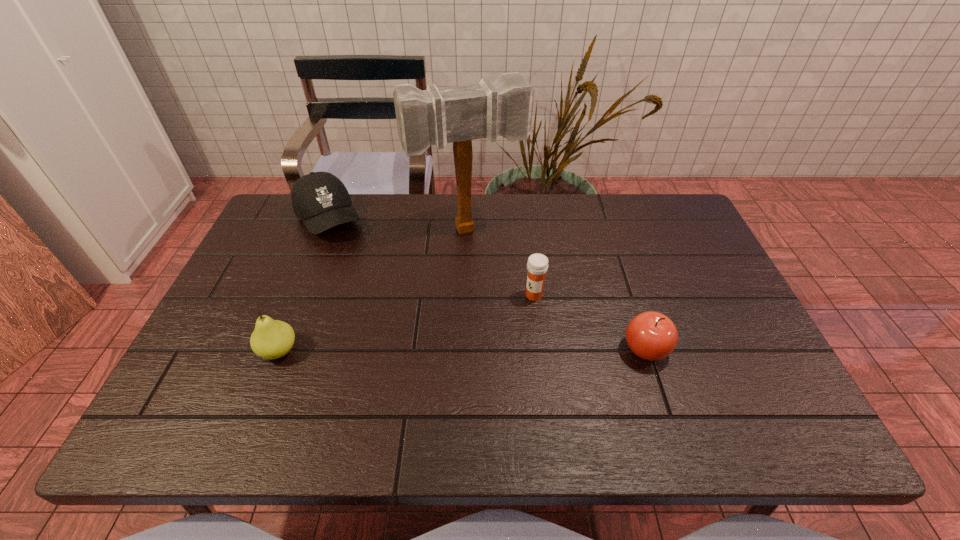
At what (x,y) coordinates should I click in order to perform the action: click on pear. Please return your answer as a coordinate pair (x, y). The image size is (960, 540). Looking at the image, I should click on (271, 339).

In order to click on apple in this screenshot , I will do `click(652, 336)`.

At what (x,y) coordinates should I click in order to perform the action: click on the tallest object. Please return your answer as a coordinate pair (x, y). The width and height of the screenshot is (960, 540). Looking at the image, I should click on (461, 114).

Where is `baseball cap`? baseball cap is located at coordinates point(320,199).

The image size is (960, 540). What are the coordinates of `the third nearest object` in the screenshot? It's located at (537, 265).

You are a GUI agent. You are given a task and a screenshot of the screen. Output one action in this format:
    pyautogui.click(x=<x>, y=<y>)
    Task: Click on the vacant area situated 0.310m on the back of the pear
    Image resolution: width=960 pixels, height=540 pixels.
    Given the screenshot: What is the action you would take?
    pyautogui.click(x=318, y=251)

In order to click on free region located on the left of the apple in this screenshot , I will do `click(474, 349)`.

This screenshot has width=960, height=540. In order to click on free point located 0.120m at the head of the tallest object in this screenshot , I will do `click(494, 276)`.

I want to click on vacant point located 0.240m at the head of the tallest object, so click(x=509, y=308).

Find the location of `free spot located 0.070m at the head of the tallest object`. free spot located 0.070m at the head of the tallest object is located at coordinates (490, 264).